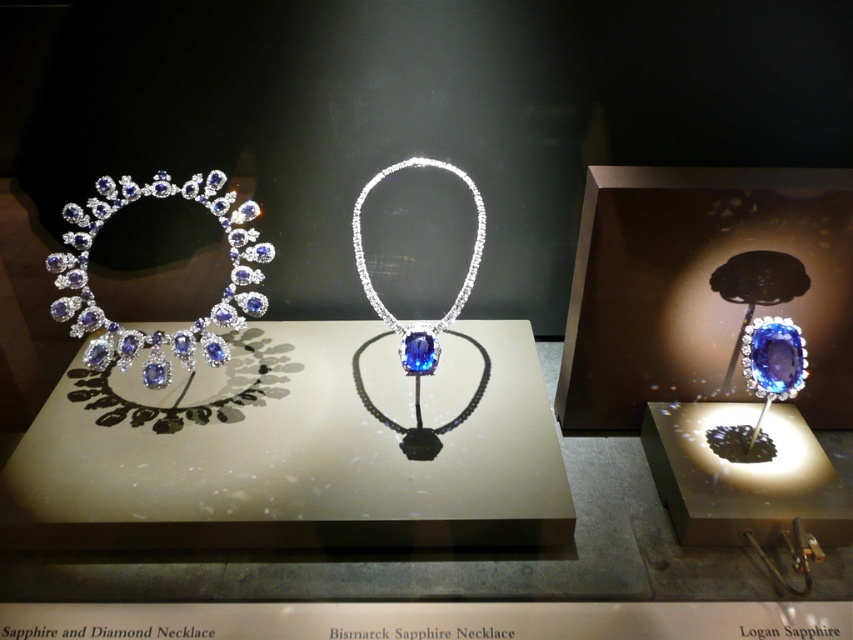
Question: Does sapphire and diamond tiara at left have a larger size compared to blue gemstone necklace at center?

Choices:
 (A) yes
 (B) no

Answer: (A)

Question: From the image, what is the correct spatial relationship of sapphire and diamond tiara at left in relation to blue gemstone necklace at center?

Choices:
 (A) above
 (B) below

Answer: (B)

Question: From the image, what is the correct spatial relationship of sapphire and diamond tiara at left in relation to blue gemstone necklace at center?

Choices:
 (A) right
 (B) left

Answer: (B)

Question: Which point is closer to the camera?

Choices:
 (A) (155, 333)
 (B) (399, 353)

Answer: (B)

Question: Among these points, which one is farthest from the camera?

Choices:
 (A) (352, 216)
 (B) (135, 340)

Answer: (A)